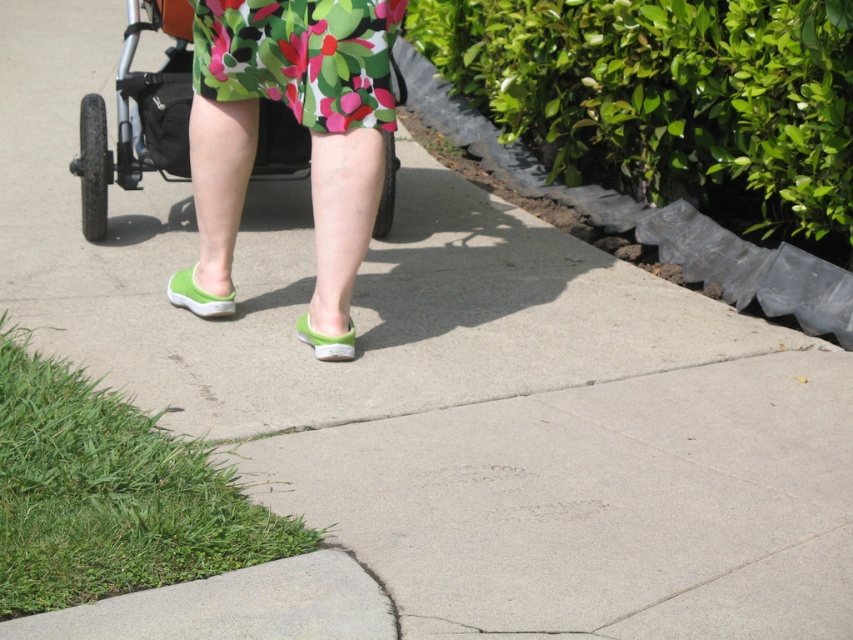
Who is taller, green rubber slipper at center or green rubber shoe at center?

green rubber slipper at center is taller.

Is point (207, 184) closer to viewer compared to point (306, 333)?

That is False.

Locate an element on the screen. The height and width of the screenshot is (640, 853). green rubber slipper at center is located at coordinates (299, 122).

Does floral fabric dress at center have a larger size compared to green rubber slipper at lower center?

Yes, floral fabric dress at center is bigger than green rubber slipper at lower center.

This screenshot has width=853, height=640. Find the location of `floral fabric dress at center`. floral fabric dress at center is located at coordinates (300, 58).

Identify the location of floral fabric dress at center. (300, 58).

Which is below, green rubber slipper at lower center or green rubber shoe at center?

green rubber shoe at center

Does green rubber slipper at lower center have a lesser width compared to green rubber shoe at center?

No.

You are a GUI agent. You are given a task and a screenshot of the screen. Output one action in this format:
    pyautogui.click(x=<x>, y=<y>)
    Task: Click on the green rubber slipper at lower center
    The height and width of the screenshot is (640, 853).
    Given the screenshot: What is the action you would take?
    pyautogui.click(x=196, y=296)